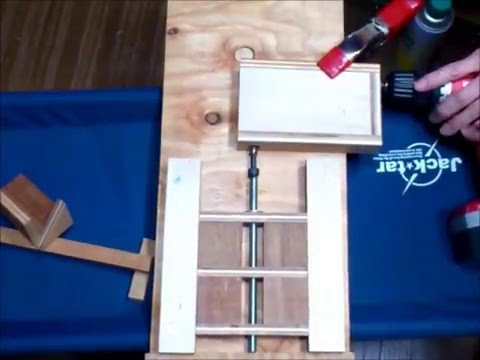
This screenshot has width=480, height=360. I want to click on blue sheet, so click(414, 313).